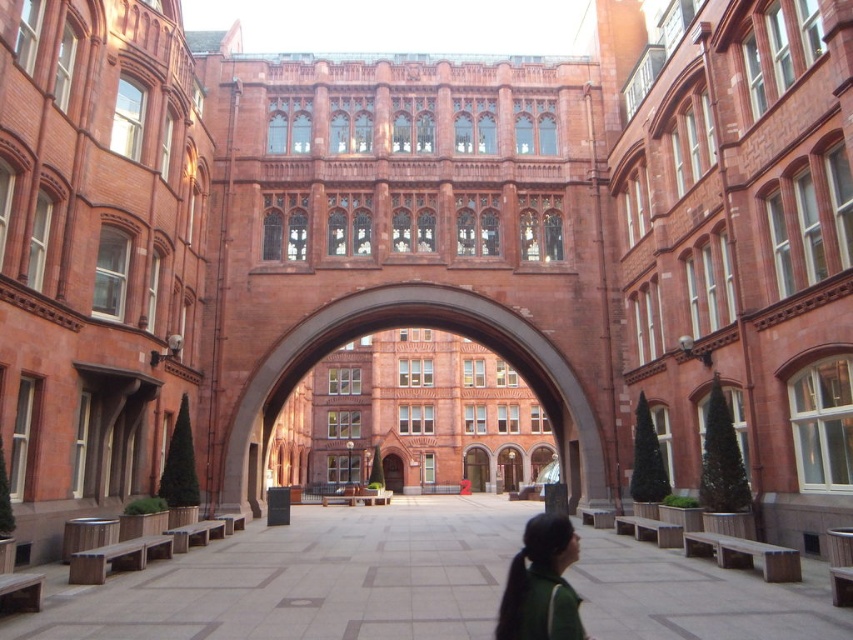
Question: Does red brick archway at center appear on the left side of green fabric at lower center?

Choices:
 (A) no
 (B) yes

Answer: (B)

Question: Which of the following is the closest to the observer?

Choices:
 (A) red brick archway at center
 (B) green fabric at lower center

Answer: (B)

Question: Where is red brick archway at center located in relation to green fabric at lower center in the image?

Choices:
 (A) right
 (B) left

Answer: (B)

Question: Considering the relative positions of smooth stone pavement at center and green fabric at lower center in the image provided, where is smooth stone pavement at center located with respect to green fabric at lower center?

Choices:
 (A) right
 (B) left

Answer: (B)

Question: Which point is farther to the camera?

Choices:
 (A) (538, 620)
 (B) (587, 464)

Answer: (B)

Question: Which is nearer to the smooth stone pavement at center?

Choices:
 (A) red brick archway at center
 (B) green fabric at lower center

Answer: (B)